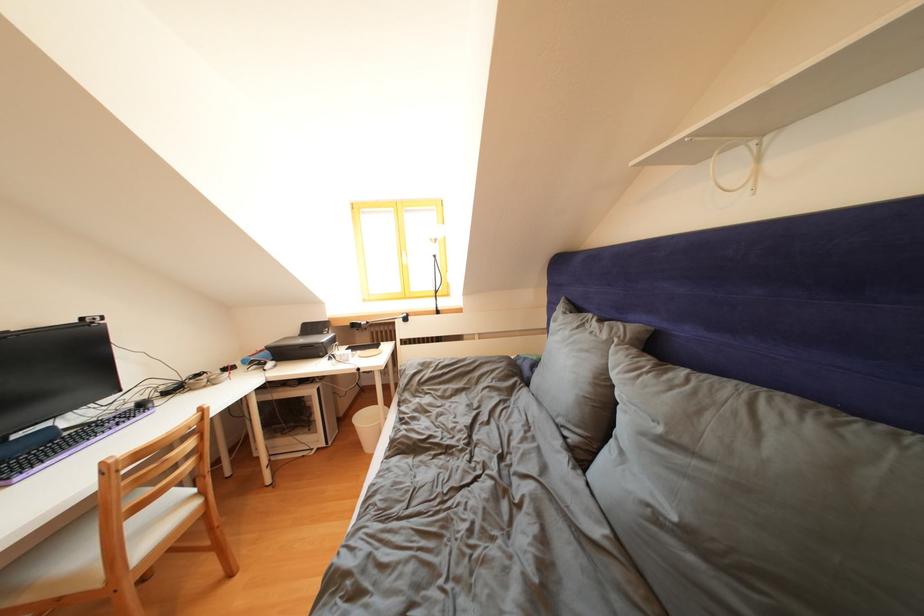
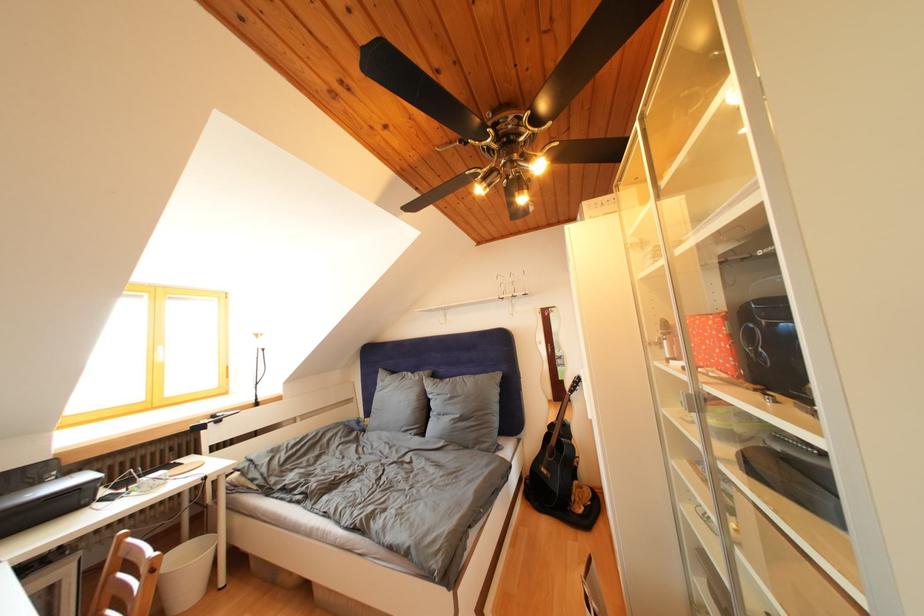
In the second image, find the point that corresponds to point 329,338 in the first image.

(44, 488)